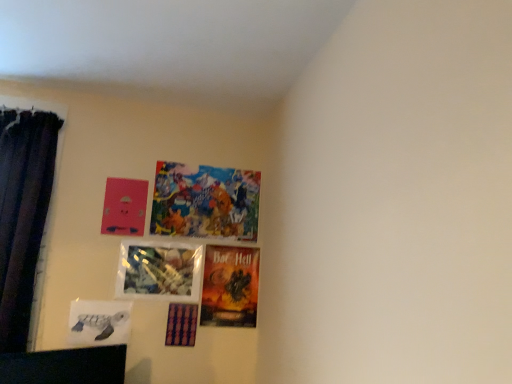
Question: Based on their positions, is matte cardboard poster at center, positioned as the 3th picture frame in bottom-to-top order, located to the left or right of dark velvet curtain at left?

Choices:
 (A) left
 (B) right

Answer: (B)

Question: In terms of width, does matte cardboard poster at center, positioned as the 3th picture frame in bottom-to-top order, look wider or thinner when compared to dark velvet curtain at left?

Choices:
 (A) wide
 (B) thin

Answer: (B)

Question: Which object is the closest to the colorful paper collage at upper center, positioned as the first picture frame in top-to-bottom order?

Choices:
 (A) matte white turtle at lower left, positioned as the fifth picture frame in top-to-bottom order
 (B) dark velvet curtain at left
 (C) translucent plastic picture frame at center, arranged as the 4th picture frame when ordered from the bottom
 (D) purple glossy picture frame at lower center, which is the 1th picture frame in bottom-to-top order
 (E) matte pink picture frame at upper left, placed as the fifth picture frame when sorted from bottom to top

Answer: (C)

Question: Which is nearer to the matte white turtle at lower left, positioned as the fifth picture frame in top-to-bottom order?

Choices:
 (A) matte pink picture frame at upper left, placed as the fifth picture frame when sorted from bottom to top
 (B) colorful paper collage at upper center, which ranks as the 6th picture frame in bottom-to-top order
 (C) dark velvet curtain at left
 (D) purple glossy picture frame at lower center, which is the 1th picture frame in bottom-to-top order
 (E) translucent plastic picture frame at center, arranged as the 4th picture frame when ordered from the bottom

Answer: (E)